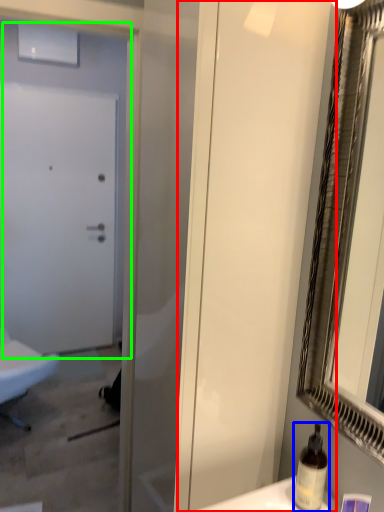
Question: Considering the real-world distances, which object is farthest from screen door (highlighted by a red box)? bottle (highlighted by a blue box) or door (highlighted by a green box)?

Choices:
 (A) bottle
 (B) door

Answer: (B)